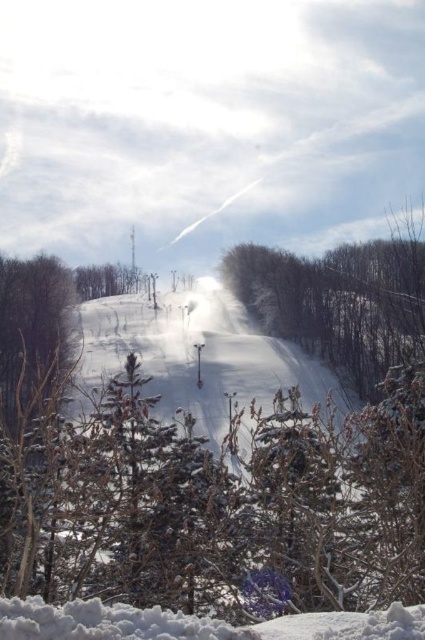
You are a skier planning to take a photo of the brown textured tree at left from the ski slope. Given the coordinates of the tree at point (33, 326), where should you position yourself on the slope to ensure the tree is in the frame?

To capture the brown textured tree at left in your photo, position yourself on the ski slope near the area corresponding to the coordinates (33, 326), ensuring the tree remains within the frame.

You are a skier planning to take a shortcut through the brown textured tree at left and the green matte tree at upper center. Which tree should you avoid hitting if you want to stay on the slope?

You should avoid hitting the brown textured tree at left because it is positioned under the green matte tree at upper center, meaning it is closer to the slope and more likely to be in your path.